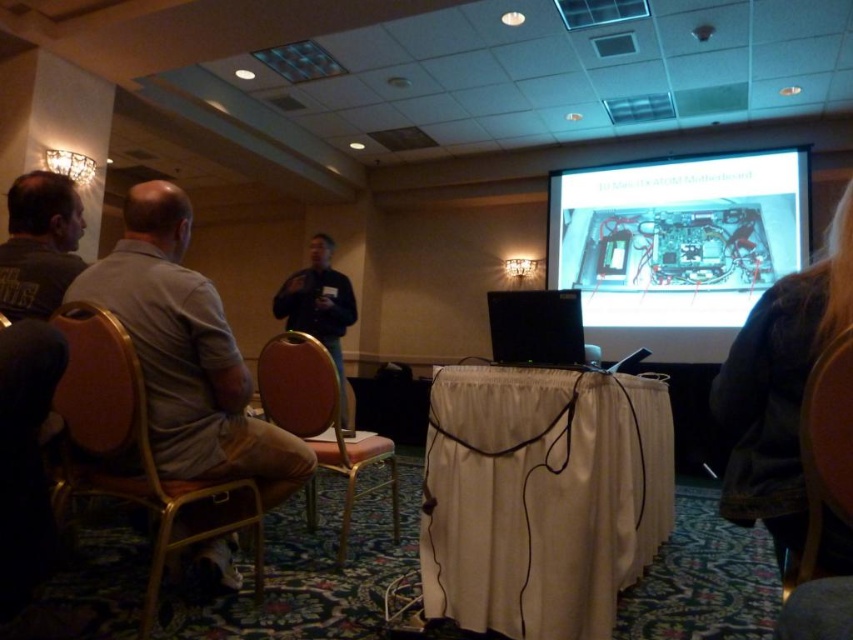
Question: Observing the image, what is the correct spatial positioning of brown fabric chair at lower right in reference to black fabric shirt at center?

Choices:
 (A) left
 (B) right

Answer: (B)

Question: Which object appears farthest from the camera in this image?

Choices:
 (A) matte gold chair at center
 (B) dark gray t-shirt at left

Answer: (A)

Question: Does brown wood chair at left have a smaller size compared to matte gold chair at center?

Choices:
 (A) yes
 (B) no

Answer: (A)

Question: Is brown wood chair at left to the left of brown fabric chair at lower right from the viewer's perspective?

Choices:
 (A) yes
 (B) no

Answer: (A)

Question: Considering the real-world distances, which object is closest to the matte gold chair at center?

Choices:
 (A) brown fuzzy jacket at lower right
 (B) brown fabric chair at lower right
 (C) white glossy projection screen at upper center
 (D) brown wood chair at left

Answer: (D)

Question: Which point is farther from the camera taking this photo?

Choices:
 (A) (329, 394)
 (B) (49, 307)

Answer: (A)